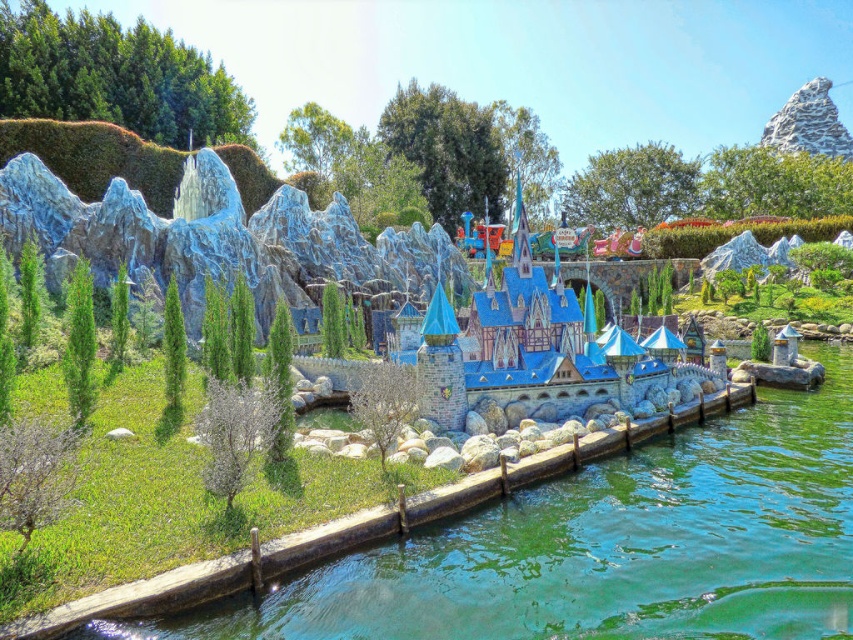
Which is above, green leafy tree at upper right or green leafy tree at upper center?

green leafy tree at upper right is above.

Can you confirm if green leafy tree at upper right is positioned above green leafy tree at upper center?

Indeed, green leafy tree at upper right is positioned over green leafy tree at upper center.

Is point (780, 195) less distant than point (612, 172)?

Yes.

Identify the location of green leafy tree at upper right. The height and width of the screenshot is (640, 853). (775, 182).

From the picture: Is green leafy hedge at upper left shorter than green leafy tree at upper right?

No, green leafy hedge at upper left is not shorter than green leafy tree at upper right.

What do you see at coordinates (115, 76) in the screenshot?
I see `green leafy hedge at upper left` at bounding box center [115, 76].

Identify the location of green leafy hedge at upper left. The height and width of the screenshot is (640, 853). (115, 76).

Identify the location of green stone lake at center. (608, 545).

Measure the distance between green stone lake at center and green leafy tree at upper center.

green stone lake at center is 136.80 meters from green leafy tree at upper center.

Does point (561, 502) come closer to viewer compared to point (590, 161)?

Yes.

Where is `green stone lake at center`? The height and width of the screenshot is (640, 853). green stone lake at center is located at coordinates (608, 545).